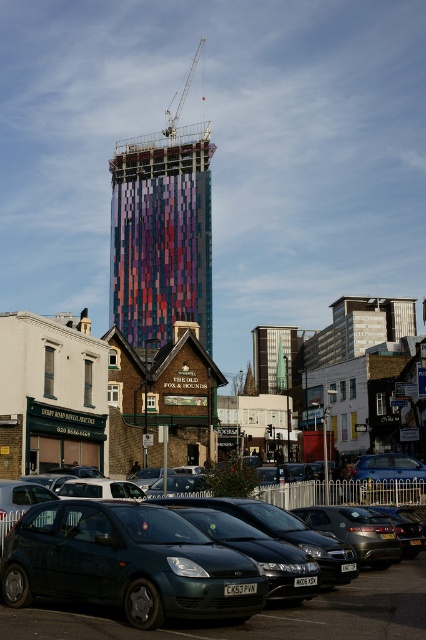
What do you see at coordinates (126, 563) in the screenshot?
I see `metallic green hatchback at center` at bounding box center [126, 563].

This screenshot has height=640, width=426. What do you see at coordinates (126, 563) in the screenshot?
I see `metallic green hatchback at center` at bounding box center [126, 563].

Locate an element on the screen. Image resolution: width=426 pixels, height=640 pixels. metallic green hatchback at center is located at coordinates (126, 563).

Between point (78, 502) and point (406, 586), which one is positioned behind?

Point (406, 586)

Describe the element at coordinates (126, 563) in the screenshot. I see `metallic green hatchback at center` at that location.

Between point (63, 515) and point (327, 618), which one is positioned behind?

Point (63, 515)

Where is `metallic green hatchback at center`? metallic green hatchback at center is located at coordinates (126, 563).

Between metallic green hatchback at center and metallic gray crane at upper center, which one has less height?

metallic green hatchback at center is shorter.

What do you see at coordinates (126, 563) in the screenshot? I see `metallic green hatchback at center` at bounding box center [126, 563].

At what (x,y) coordinates should I click in order to perform the action: click on metallic green hatchback at center. Please return your answer as a coordinate pair (x, y). Looking at the image, I should click on (126, 563).